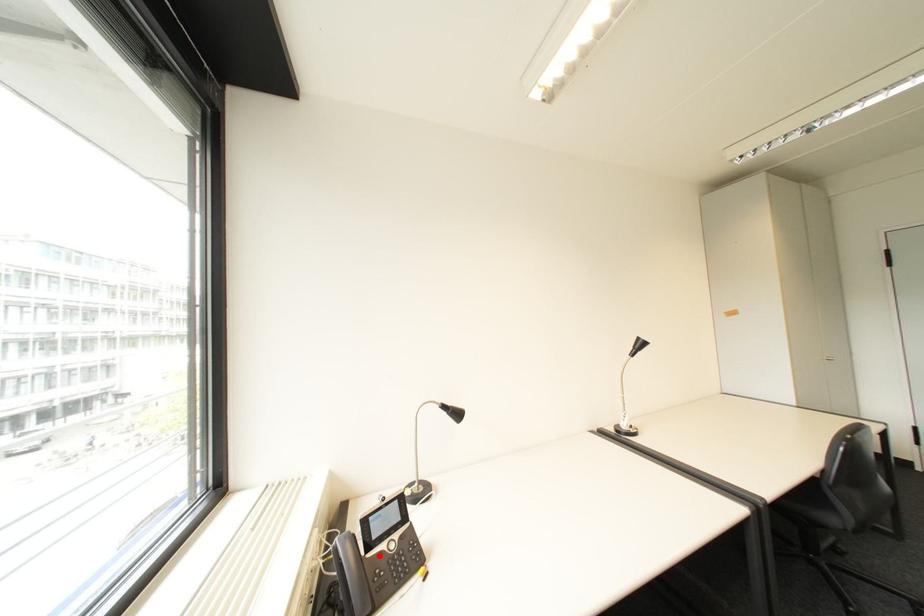
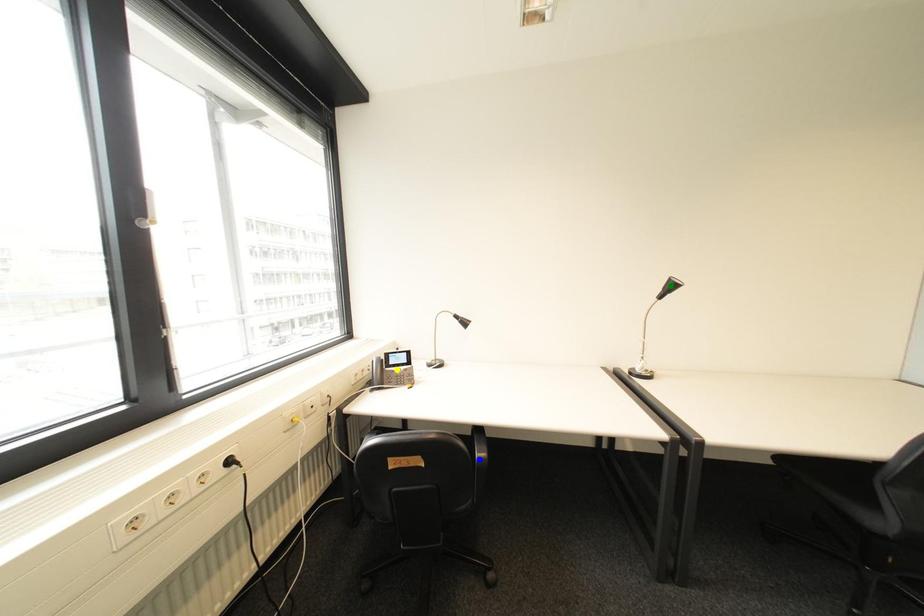
Question: I am providing you with two images of the same scene from different viewpoints. A red point is marked on the first image. You are given multiple points on the second image. Which mark in image 2 goes with the point in image 1?

Choices:
 (A) yellow point
 (B) green point
 (C) blue point

Answer: (A)